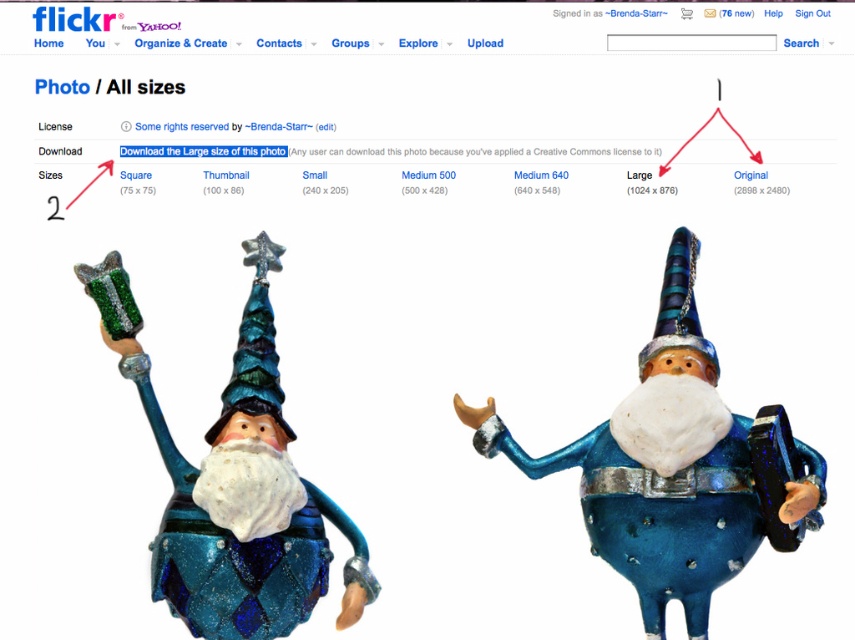
You are a photographer trying to locate a specific point on the image. The point you need to find is at coordinates point [676,467]. Which object in the image is this point located on?

The point [676,467] is located on the matte blue glass gnome at center.

Looking at this image, you are a user on Flickr trying to locate the matte blue glass gnome at center in the photo. The photo has a coordinate system where the top left corner is the origin point. If the gnome is at point 0.731, 0.792, which part of the photo should you look at?

The matte blue glass gnome at center is located at point (676, 467) in the photo. Since the coordinate system starts at the top left corner, this position corresponds to the lower right area of the photo.